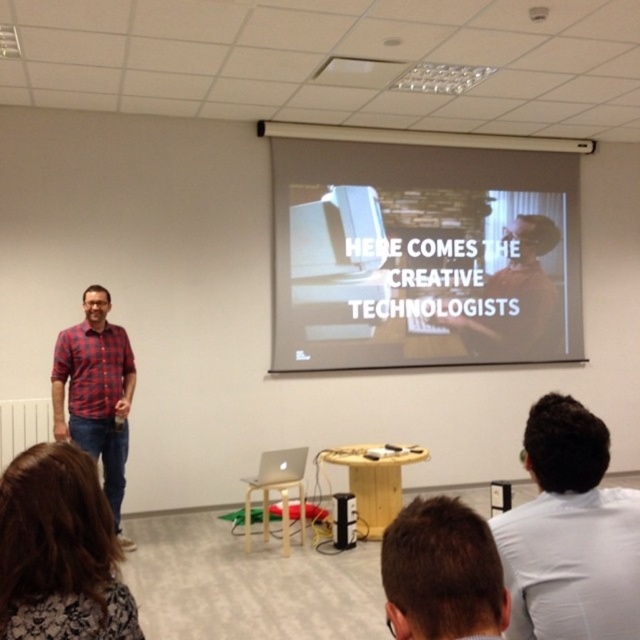
Image resolution: width=640 pixels, height=640 pixels. What do you see at coordinates (60, 550) in the screenshot? I see `brown hair at lower left` at bounding box center [60, 550].

Does point (4, 502) come in front of point (125, 401)?

Yes, it is in front of point (125, 401).

Is point (33, 580) less distant than point (109, 435)?

Yes, it is in front of point (109, 435).

I want to click on brown hair at lower left, so click(x=60, y=550).

Can you confirm if white shirt at upper right is wider than red plaid shirt at left?

In fact, white shirt at upper right might be narrower than red plaid shirt at left.

Consider the image. Does white shirt at upper right appear under red plaid shirt at left?

No, white shirt at upper right is not below red plaid shirt at left.

Image resolution: width=640 pixels, height=640 pixels. What do you see at coordinates (570, 532) in the screenshot? I see `white shirt at upper right` at bounding box center [570, 532].

Where is `white shirt at upper right`? white shirt at upper right is located at coordinates (570, 532).

Does matte black laptop at center have a lesser height compared to black plastic speaker at center?

In fact, matte black laptop at center may be taller than black plastic speaker at center.

Who is higher up, matte black laptop at center or black plastic speaker at center?

matte black laptop at center is above.

Is point (516, 336) closer to camera compared to point (339, 529)?

That is False.

The width and height of the screenshot is (640, 640). I want to click on matte black laptop at center, so click(x=515, y=291).